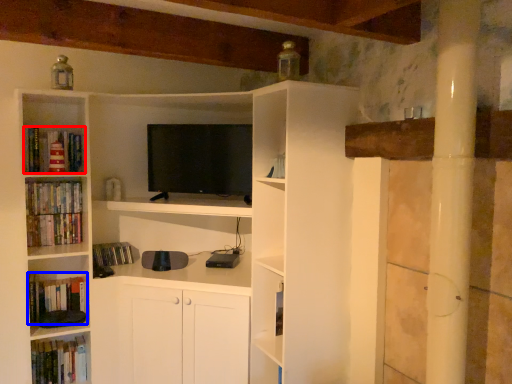
Question: Which object is further to the camera taking this photo, book (highlighted by a red box) or book (highlighted by a blue box)?

Choices:
 (A) book
 (B) book

Answer: (B)